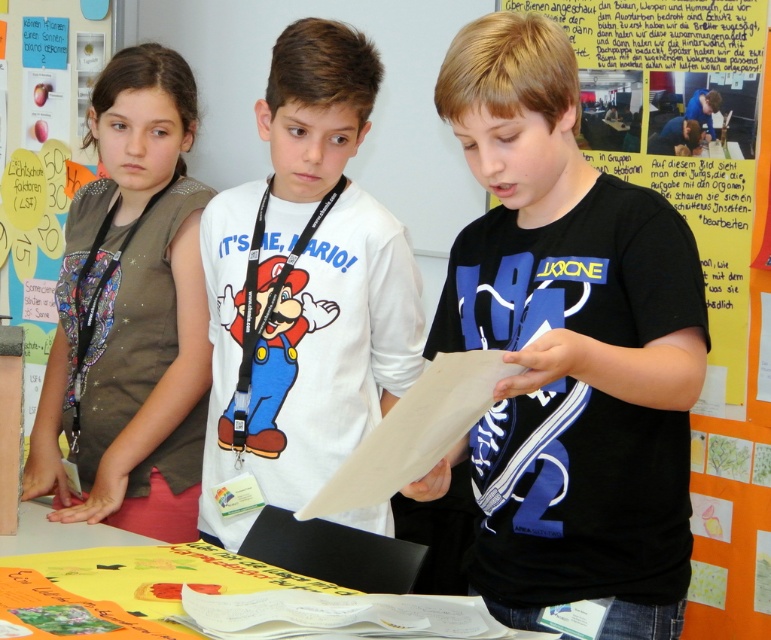
You are a teacher in the classroom. You need to place a new whiteboard between the black matte paper at center and the multicolored fabric poster at left. Can you do this without moving either object?

The black matte paper at center is in front of the multicolored fabric poster at left, so placing a new whiteboard between them would require moving at least one of the objects to create space. Therefore, it is not possible to place the whiteboard between them without moving either object.